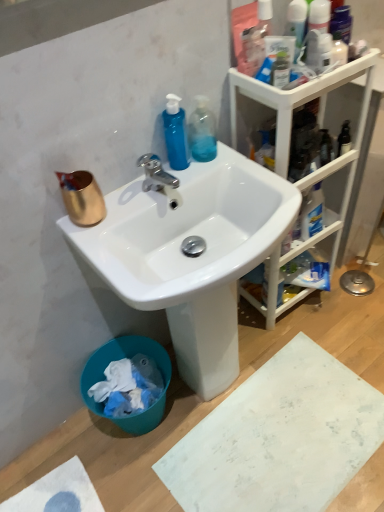
Describe the element at coordinates (280, 70) in the screenshot. I see `translucent plastic bottle at upper right` at that location.

You are a GUI agent. You are given a task and a screenshot of the screen. Output one action in this format:
    pyautogui.click(x=<x>, y=<y>)
    Task: Click on the translucent plastic bottle at upper right
    
    Given the screenshot: What is the action you would take?
    pyautogui.click(x=280, y=70)

Measure the distance between point [279,93] and camera.

A distance of 1.05 meters exists between point [279,93] and camera.

Locate an element on the screen. transparent plastic bottle at upper center, the second cleaning product from the left is located at coordinates (202, 131).

The height and width of the screenshot is (512, 384). Find the location of `chrome metallic faucet at upper center`. chrome metallic faucet at upper center is located at coordinates pyautogui.click(x=155, y=174).

This screenshot has width=384, height=512. Find the location of `translucent plastic bottle at upper right`. translucent plastic bottle at upper right is located at coordinates (280, 70).

Considering the positions of objects chrome metallic faucet at upper center and teal plastic trash bin at lower left in the image provided, who is more to the left, chrome metallic faucet at upper center or teal plastic trash bin at lower left?

teal plastic trash bin at lower left.

Is point (154, 179) less distant than point (145, 413)?

Yes, point (154, 179) is closer to viewer.

From a real-world perspective, is chrome metallic faucet at upper center positioned over teal plastic trash bin at lower left based on gravity?

Yes, from a real-world perspective, chrome metallic faucet at upper center is on top of teal plastic trash bin at lower left.

Can you confirm if chrome metallic faucet at upper center is thinner than teal plastic trash bin at lower left?

Indeed, chrome metallic faucet at upper center has a lesser width compared to teal plastic trash bin at lower left.

Is copper metallic cup at upper left touching chrome metallic faucet at upper center?

No, copper metallic cup at upper left is not in contact with chrome metallic faucet at upper center.

Does copper metallic cup at upper left contain chrome metallic faucet at upper center?

No, chrome metallic faucet at upper center is not inside copper metallic cup at upper left.

Considering the sizes of objects copper metallic cup at upper left and chrome metallic faucet at upper center in the image provided, who is bigger, copper metallic cup at upper left or chrome metallic faucet at upper center?

copper metallic cup at upper left.

This screenshot has height=512, width=384. What are the coordinates of `coffee cup below the chrome metallic faucet at upper center (from the image's perspective)` in the screenshot? It's located at coord(82,197).

Can you tell me how much white glossy sink at center and teal plastic trash bin at lower left differ in facing direction?

white glossy sink at center and teal plastic trash bin at lower left are facing 0.728 degrees away from each other.

In the image, is white glossy sink at center positioned in front of or behind teal plastic trash bin at lower left?

white glossy sink at center is positioned closer to the viewer than teal plastic trash bin at lower left.

Which is correct: white glossy sink at center is inside teal plastic trash bin at lower left, or outside of it?

white glossy sink at center lies outside teal plastic trash bin at lower left.

Is white glossy sink at center smaller than teal plastic trash bin at lower left?

Actually, white glossy sink at center might be larger than teal plastic trash bin at lower left.

Who is smaller, chrome metallic faucet at upper center or transparent plastic bottle at upper center, placed as the 1th cleaning product when sorted from right to left?

With smaller size is transparent plastic bottle at upper center, placed as the 1th cleaning product when sorted from right to left.

From a real-world perspective, between chrome metallic faucet at upper center and transparent plastic bottle at upper center, placed as the 1th cleaning product when sorted from right to left, who is vertically higher?

In real-world perspective, transparent plastic bottle at upper center, placed as the 1th cleaning product when sorted from right to left, is above.

Can you see chrome metallic faucet at upper center touching transparent plastic bottle at upper center, the second cleaning product from the left?

No, chrome metallic faucet at upper center is not beside transparent plastic bottle at upper center, the second cleaning product from the left.

Considering the relative positions of chrome metallic faucet at upper center and white glossy sink at center in the image provided, is chrome metallic faucet at upper center behind white glossy sink at center?

Yes, it is behind white glossy sink at center.

Can you see chrome metallic faucet at upper center touching white glossy sink at center?

No.

Is chrome metallic faucet at upper center aimed at white glossy sink at center?

No, chrome metallic faucet at upper center does not turn towards white glossy sink at center.

Which is in front, chrome metallic faucet at upper center or copper metallic cup at upper left?

copper metallic cup at upper left is closer to the camera.

Is chrome metallic faucet at upper center shorter than copper metallic cup at upper left?

Indeed, chrome metallic faucet at upper center has a lesser height compared to copper metallic cup at upper left.

Is chrome metallic faucet at upper center wider or thinner than copper metallic cup at upper left?

chrome metallic faucet at upper center is wider than copper metallic cup at upper left.

Is teal plastic trash bin at lower left facing away from translucent plastic bottle at upper right?

No, translucent plastic bottle at upper right is not at the back of teal plastic trash bin at lower left.

Is point (99, 414) positioned in front of point (277, 73)?

No, (99, 414) is further to viewer.

Is there a large distance between teal plastic trash bin at lower left and translucent plastic bottle at upper right?

Indeed, teal plastic trash bin at lower left is not near translucent plastic bottle at upper right.

Is teal plastic trash bin at lower left at the left side of translucent plastic bottle at upper right?

Yes.

Find the location of a particular element. trash bin/can below the chrome metallic faucet at upper center (from the image's perspective) is located at coordinates (119, 359).

The height and width of the screenshot is (512, 384). In order to click on coffee cup positioned vertically above the chrome metallic faucet at upper center (from a real-world perspective) in this screenshot , I will do `click(82, 197)`.

Considering their positions, is teal plastic trash bin at lower left positioned closer to chrome metallic faucet at upper center than copper metallic cup at upper left?

copper metallic cup at upper left is positioned closer to the anchor chrome metallic faucet at upper center.

Looking at the image, which one is located closer to copper metallic cup at upper left, white glossy sink at center or white plastic cabinet at upper right?

The object closer to copper metallic cup at upper left is white glossy sink at center.

From the image, which object appears to be farther from white glossy sink at center, white matte cardboard at lower right or translucent plastic bottle at upper right?

The object further to white glossy sink at center is translucent plastic bottle at upper right.

Based on their spatial positions, is blue translucent bottle at upper center, positioned as the 2th cleaning product in right-to-left order, or transparent plastic bottle at upper center, placed as the 1th cleaning product when sorted from right to left, further from white plastic cabinet at upper right?

Among the two, blue translucent bottle at upper center, positioned as the 2th cleaning product in right-to-left order, is located further to white plastic cabinet at upper right.

Based on their spatial positions, is translucent plastic bottle at upper right or white matte cardboard at lower right closer to transparent plastic bottle at upper center, the second cleaning product from the left?

translucent plastic bottle at upper right lies closer to transparent plastic bottle at upper center, the second cleaning product from the left, than the other object.

Based on their spatial positions, is blue translucent bottle at upper center, placed as the 1th cleaning product when sorted from left to right, or copper metallic cup at upper left closer to chrome metallic faucet at upper center?

The object closer to chrome metallic faucet at upper center is blue translucent bottle at upper center, placed as the 1th cleaning product when sorted from left to right.

Considering their positions, is copper metallic cup at upper left positioned closer to chrome metallic faucet at upper center than teal plastic trash bin at lower left?

copper metallic cup at upper left is closer to chrome metallic faucet at upper center.

Based on the photo, from the image, which object appears to be farther from blue translucent bottle at upper center, placed as the 1th cleaning product when sorted from left to right, transparent plastic bottle at upper center, the second cleaning product from the left, or white matte cardboard at lower right?

white matte cardboard at lower right.

What are the coordinates of `cleaning product situated between copper metallic cup at upper left and transparent plastic bottle at upper center, placed as the 1th cleaning product when sorted from right to left, from left to right` in the screenshot? It's located at (175, 133).

Find the location of a particular element. cabinetry between chrome metallic faucet at upper center and teal plastic trash bin at lower left vertically is located at coordinates (289, 150).

Identify the location of cabinetry between transparent plastic bottle at upper center, placed as the 1th cleaning product when sorted from right to left, and teal plastic trash bin at lower left, in the vertical direction. This screenshot has height=512, width=384. (289, 150).

At what (x,y) coordinates should I click in order to perform the action: click on tap between blue translucent bottle at upper center, placed as the 1th cleaning product when sorted from left to right, and teal plastic trash bin at lower left, in the vertical direction. Please return your answer as a coordinate pair (x, y). The height and width of the screenshot is (512, 384). Looking at the image, I should click on (155, 174).